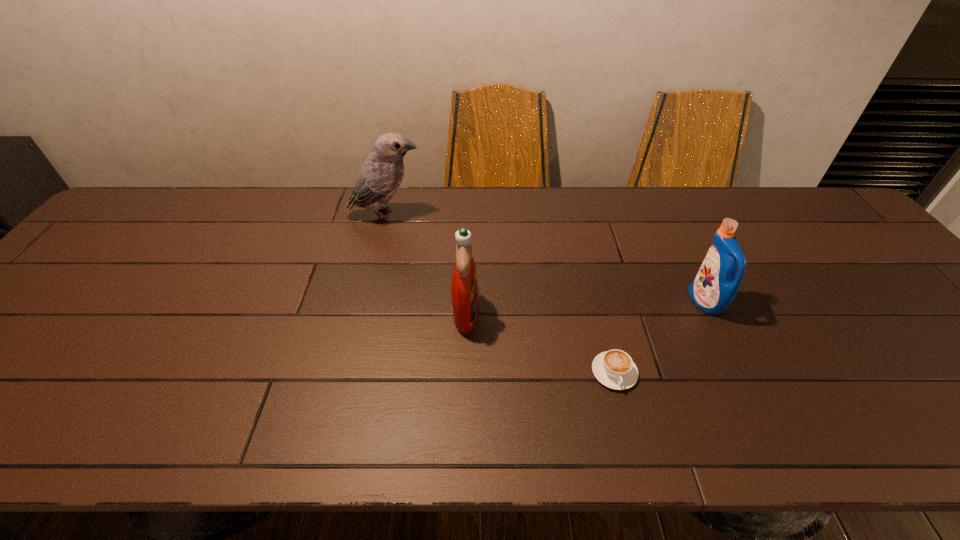
This screenshot has width=960, height=540. In order to click on free space located 0.160m on the label of the rightmost object in this screenshot , I will do `click(628, 302)`.

The image size is (960, 540). I want to click on free space located 0.120m on the side of the shortest object with the handle, so click(x=634, y=448).

I want to click on object present at the far edge, so pyautogui.click(x=379, y=178).

At what (x,y) coordinates should I click in order to perform the action: click on vacant space at the far edge of the desktop. Please return your answer as a coordinate pair (x, y). Looking at the image, I should click on (519, 203).

Where is `vacant space at the near edge of the desktop`? vacant space at the near edge of the desktop is located at coordinates pyautogui.click(x=435, y=438).

Find the location of a particular element. The height and width of the screenshot is (540, 960). blank space at the far left corner of the desktop is located at coordinates (110, 231).

Image resolution: width=960 pixels, height=540 pixels. In order to click on free space between the parrot and the second object from left to right in this screenshot , I will do `click(426, 265)`.

Locate an element on the screen. empty location between the nearest object and the parrot is located at coordinates (500, 294).

Locate an element on the screen. vacant region between the rightmost object and the leftmost object is located at coordinates (545, 259).

The image size is (960, 540). I want to click on vacant space that is in between the right detergent and the farthest object, so click(545, 259).